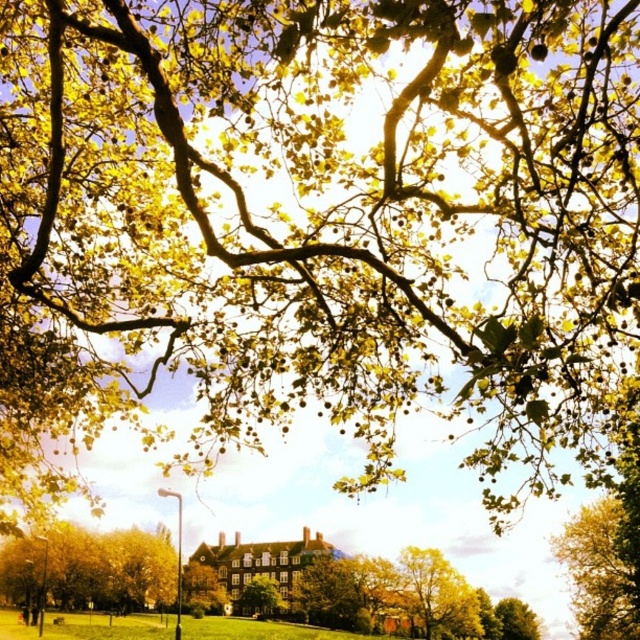
Is golden leafy tree at upper center bigger than green leafy tree at center?

Yes, golden leafy tree at upper center is bigger than green leafy tree at center.

Locate an element on the screen. This screenshot has width=640, height=640. golden leafy tree at upper center is located at coordinates (600, 572).

What do you see at coordinates (600, 572) in the screenshot? I see `golden leafy tree at upper center` at bounding box center [600, 572].

Image resolution: width=640 pixels, height=640 pixels. Find the location of `golden leafy tree at upper center`. golden leafy tree at upper center is located at coordinates (600, 572).

Who is positioned more to the left, golden textured leaves at lower center or green leafy tree at center?

golden textured leaves at lower center

Locate an element on the screen. This screenshot has width=640, height=640. golden textured leaves at lower center is located at coordinates (90, 570).

Who is higher up, golden textured leaves at lower center or golden leafy tree at upper center?

Positioned higher is golden leafy tree at upper center.

Between golden textured leaves at lower center and golden leafy tree at upper center, which one has less height?

With less height is golden textured leaves at lower center.

Who is more forward, [10,573] or [570,577]?

Positioned in front is point [10,573].

You are a GUI agent. You are given a task and a screenshot of the screen. Output one action in this format:
    pyautogui.click(x=<x>, y=<y>)
    Task: Click on the golden textured leaves at lower center
    
    Given the screenshot: What is the action you would take?
    pyautogui.click(x=90, y=570)